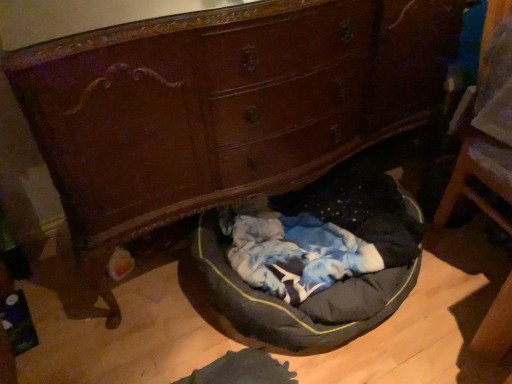
Question: Should I look upward or downward to see wooden chair at right?

Choices:
 (A) down
 (B) up

Answer: (B)

Question: Are black fabric dog bed at center and wooden chair at right far apart?

Choices:
 (A) yes
 (B) no

Answer: (B)

Question: Can you confirm if black fabric dog bed at center is taller than wooden chair at right?

Choices:
 (A) yes
 (B) no

Answer: (B)

Question: Does black fabric dog bed at center appear on the right side of wooden chair at right?

Choices:
 (A) yes
 (B) no

Answer: (B)

Question: Is black fabric dog bed at center aimed at wooden chair at right?

Choices:
 (A) yes
 (B) no

Answer: (B)

Question: Is black fabric dog bed at center bigger than wooden chair at right?

Choices:
 (A) no
 (B) yes

Answer: (B)

Question: Can you confirm if black fabric dog bed at center is smaller than wooden chair at right?

Choices:
 (A) no
 (B) yes

Answer: (A)

Question: Is wooden chair at right looking in the opposite direction of black fabric dog bed at center?

Choices:
 (A) yes
 (B) no

Answer: (B)

Question: Is the depth of wooden chair at right greater than that of black fabric dog bed at center?

Choices:
 (A) yes
 (B) no

Answer: (B)

Question: Considering the relative positions of wooden chair at right and black fabric dog bed at center in the image provided, is wooden chair at right to the right of black fabric dog bed at center from the viewer's perspective?

Choices:
 (A) no
 (B) yes

Answer: (B)

Question: Is wooden chair at right located outside black fabric dog bed at center?

Choices:
 (A) no
 (B) yes

Answer: (B)

Question: Does wooden chair at right have a lesser width compared to black fabric dog bed at center?

Choices:
 (A) yes
 (B) no

Answer: (A)

Question: Is wooden chair at right aimed at black fabric dog bed at center?

Choices:
 (A) no
 (B) yes

Answer: (A)

Question: Considering the positions of point (217, 324) and point (494, 89), is point (217, 324) closer or farther from the camera than point (494, 89)?

Choices:
 (A) closer
 (B) farther

Answer: (B)